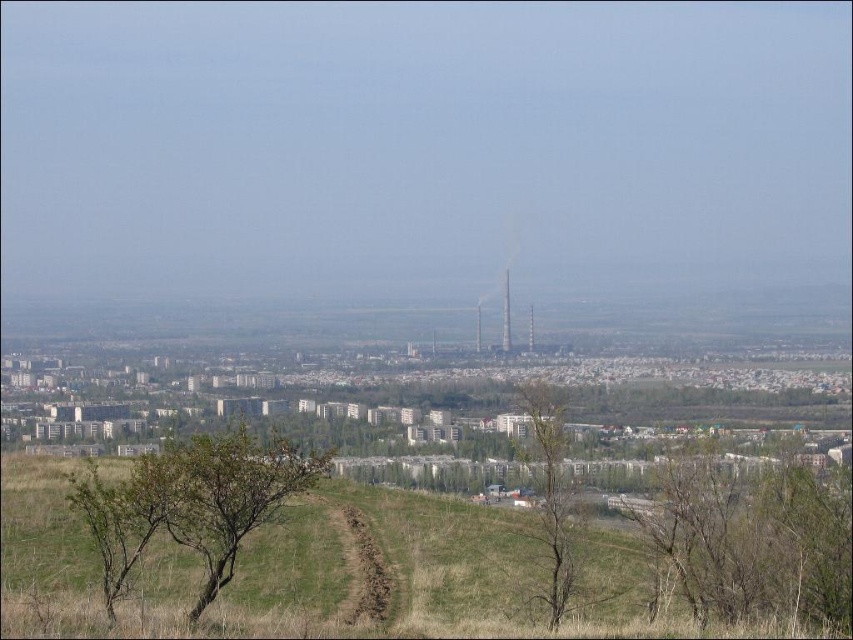
You are standing on a grassy hill overlooking the city. You see a brown leafless tree at lower right and a green leafy tree at center. Which tree would appear larger in your field of view?

The brown leafless tree at lower right is closer to the viewer than the green leafy tree at center, so it would appear larger in your field of view.

You are standing at the center of the image and want to find the brown leafless tree at lower right. In which direction should you look to see it?

The brown leafless tree at lower right is located at point (x=751, y=538) in 2D coordinates, so you should look to the lower right direction to see it.

You are an urban planner evaluating the green spaces in the city. You notice the brown leafless tree at lower right and the green leafy tree at center. Which tree occupies a larger horizontal space in the image?

The brown leafless tree at lower right is wider than the green leafy tree at center, so it occupies a larger horizontal space in the image.